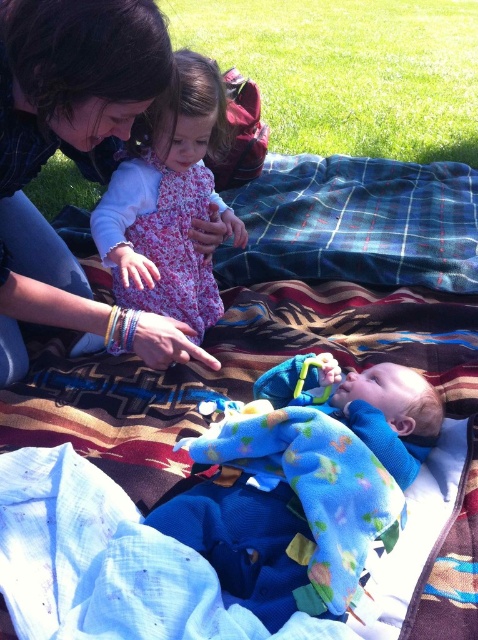
You are a photographer trying to capture a closeup shot of the matte black hair at upper left and the floral dress at upper center. Which object should you zoom in on more to ensure both are in focus?

The matte black hair at upper left is larger in size compared to the floral dress at upper center, so you should zoom in more on the floral dress at upper center to ensure both are in focus.

What are the exact coordinates of the soft blue plush toy at center?

The soft blue plush toy at center is located at coordinates (305, 486).